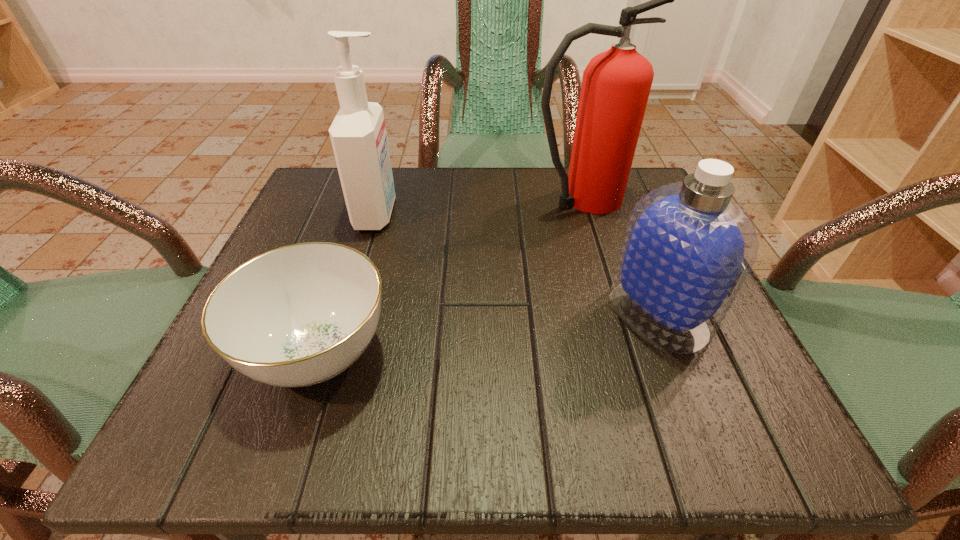
You are a GUI agent. You are given a task and a screenshot of the screen. Output one action in this format:
    pyautogui.click(x=<x>, y=<y>)
    Task: Click on the fire extinguisher
    
    Given the screenshot: What is the action you would take?
    pyautogui.click(x=616, y=84)

The width and height of the screenshot is (960, 540). I want to click on the farther cleansing agent, so click(x=358, y=135).

Find the location of a particular element. The width and height of the screenshot is (960, 540). the left cleansing agent is located at coordinates (358, 135).

Locate an element on the screen. the right cleansing agent is located at coordinates (688, 248).

This screenshot has height=540, width=960. What are the coordinates of `the second shortest object` in the screenshot? It's located at (688, 248).

You are a GUI agent. You are given a task and a screenshot of the screen. Output one action in this format:
    pyautogui.click(x=<x>, y=<y>)
    Task: Click on the shortest object
    The height and width of the screenshot is (540, 960).
    Given the screenshot: What is the action you would take?
    pyautogui.click(x=299, y=315)

I want to click on free spot located 0.050m on the handle side of the fire extinguisher, so click(x=654, y=199).

Identify the location of vacant area located 0.090m on the front label of the farther cleansing agent. click(x=443, y=214).

Find the location of `free spot located 0.050m on the left of the nearer cleansing agent`. free spot located 0.050m on the left of the nearer cleansing agent is located at coordinates (580, 314).

Where is `free space located on the back of the shortest object`? free space located on the back of the shortest object is located at coordinates (357, 235).